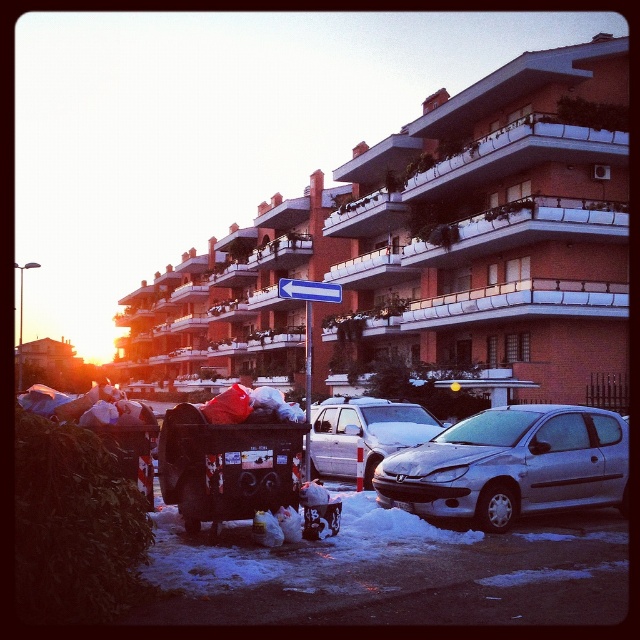
You are a delivery person who needs to park your car, which is 10 feet long, between the silver metallic car at lower right and the metallic garbage cart at lower left. Is there enough space between them for your car?

The distance between the silver metallic car at lower right and the metallic garbage cart at lower left is 11.13 feet, which is slightly longer than your 10 feet long car. Therefore, there is enough space to park your car between them.

You are standing at the point with coordinates point (381, 442) and want to walk towards the point with coordinates point (195, 532). Which direction should you move relative to your current position?

Since point (195, 532) is in front of point (381, 442), you should move forward to reach it.